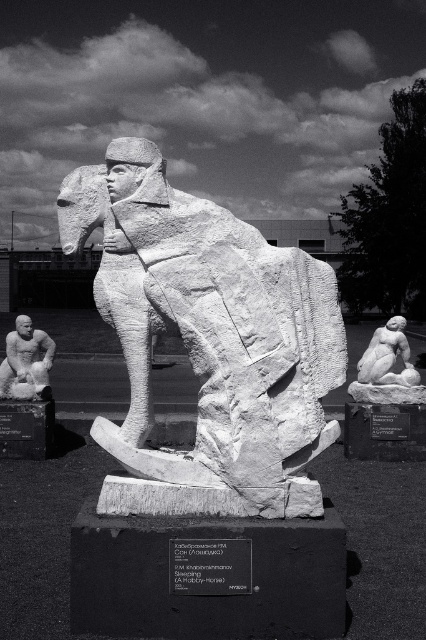
Who is shorter, smooth stone man at center or white marble reclining figure at lower right?

Standing shorter between the two is white marble reclining figure at lower right.

This screenshot has width=426, height=640. What do you see at coordinates (26, 362) in the screenshot?
I see `smooth stone man at center` at bounding box center [26, 362].

Locate an element on the screen. smooth stone man at center is located at coordinates (26, 362).

Does white stone horse at center appear over smooth stone man at center?

Indeed, white stone horse at center is positioned over smooth stone man at center.

Identify the location of white stone horse at center. (209, 339).

Is white stone horse at center bigger than white marble reclining figure at lower right?

Yes.

Does white stone horse at center come behind white marble reclining figure at lower right?

No, it is not.

Is point (321, 269) farther from camera compared to point (408, 348)?

No, (321, 269) is closer to viewer.

Image resolution: width=426 pixels, height=640 pixels. I want to click on white stone horse at center, so click(209, 339).